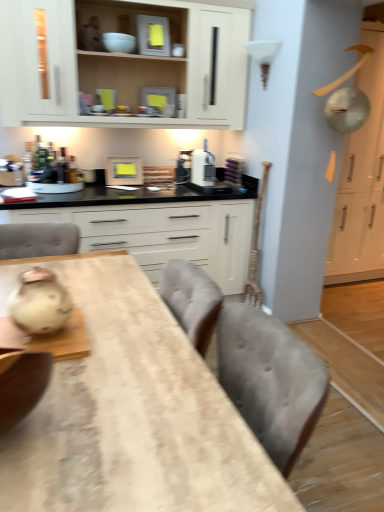
At what (x,y) coordinates should I click in order to perform the action: click on free location to the right of matte white ceramic tea pot at left. Please return your answer as a coordinate pair (x, y). Looking at the image, I should click on (115, 332).